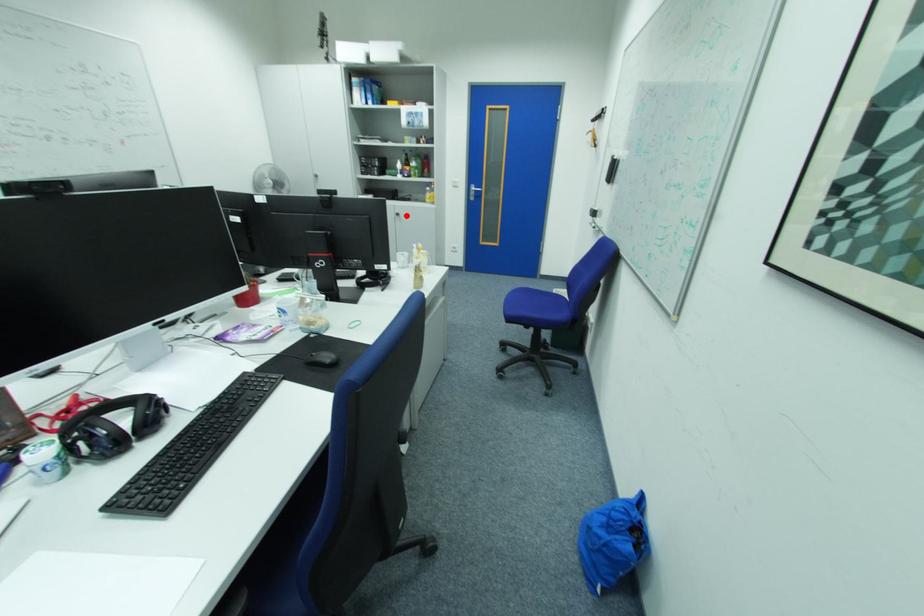
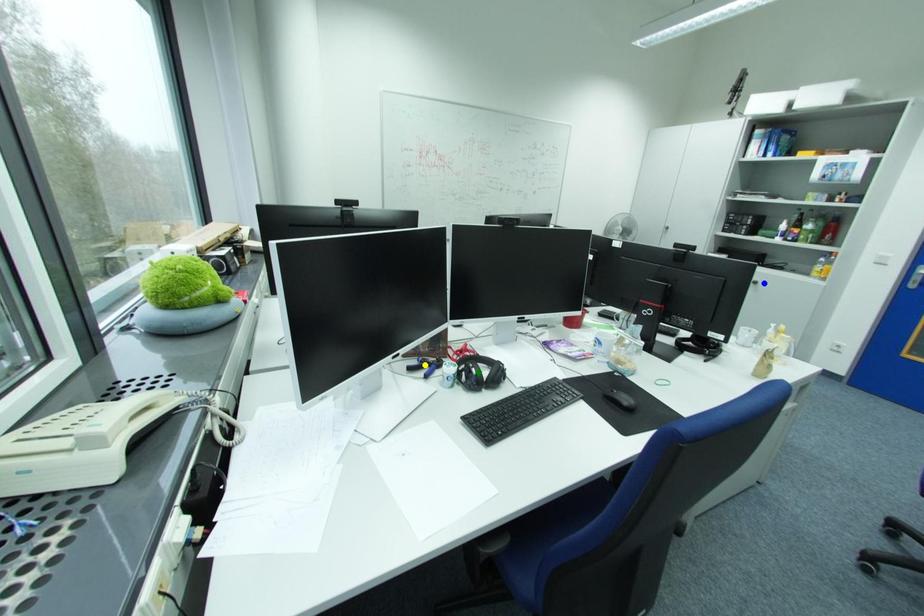
Question: I am providing you with two images of the same scene from different viewpoints. A red point is marked on the first image. You are given multiple points on the second image. Can you choose the point in image 2 that corresponds to the point in image 1?

Choices:
 (A) green point
 (B) yellow point
 (C) blue point

Answer: (C)